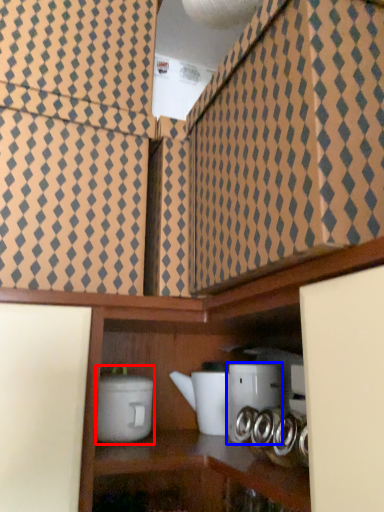
Question: Among these objects, which one is farthest to the camera, appliance (highlighted by a red box) or appliance (highlighted by a blue box)?

Choices:
 (A) appliance
 (B) appliance

Answer: (B)